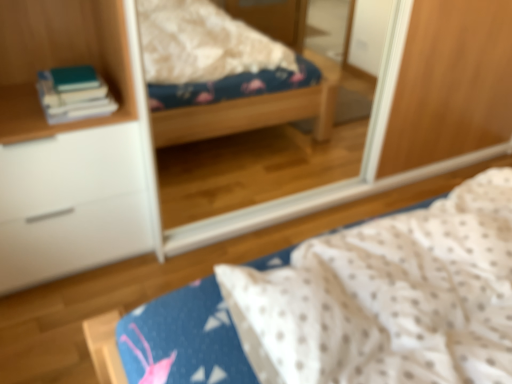
Question: Is white matte cabinet at left inside or outside of white dotted fabric at center?

Choices:
 (A) outside
 (B) inside

Answer: (A)

Question: In terms of size, does white matte cabinet at left appear bigger or smaller than white dotted fabric at center?

Choices:
 (A) big
 (B) small

Answer: (A)

Question: Which is farther from the white dotted fabric at center?

Choices:
 (A) clear glass mirror at upper center
 (B) hardcover books at left
 (C) white matte cabinet at left

Answer: (A)

Question: Based on their relative distances, which object is farther from the hardcover books at left?

Choices:
 (A) white dotted fabric at center
 (B) clear glass mirror at upper center
 (C) white matte cabinet at left

Answer: (B)